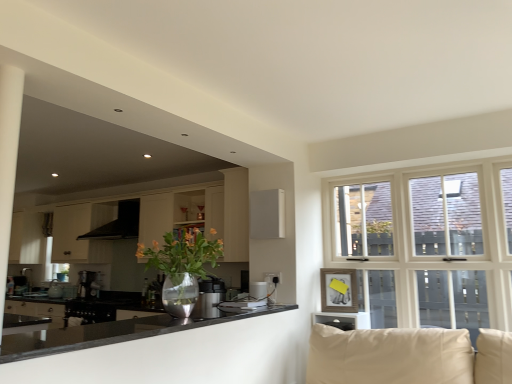
Question: Considering their positions, is satin silver kettle at center located in front of or behind black glossy countertop at lower left?

Choices:
 (A) behind
 (B) front

Answer: (A)

Question: Is satin silver kettle at center bigger or smaller than black glossy countertop at lower left?

Choices:
 (A) big
 (B) small

Answer: (B)

Question: Which object is the closest to the satin silver coffee machine at left?

Choices:
 (A) metallic vase with flowers at center
 (B) matte wood cabinet at center, which ranks as the 1th cabinetry in right-to-left order
 (C) satin silver kettle at center
 (D) black matte exhaust hood at upper left
 (E) white matte cabinet at left, which ranks as the first cabinetry in back-to-front order

Answer: (E)

Question: Which of these objects is positioned farthest from the black matte exhaust hood at upper left?

Choices:
 (A) satin silver kettle at center
 (B) satin silver coffee machine at left
 (C) metallic vase with flowers at center
 (D) white matte cabinet at left, the first cabinetry when ordered from left to right
 (E) matte wood cabinet at center, marked as the first cabinetry in a front-to-back arrangement

Answer: (A)